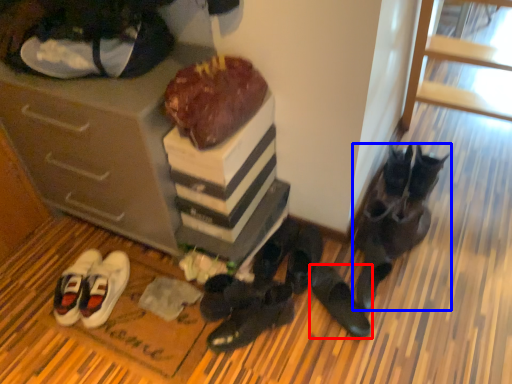
Question: Which of the following is the closest to the observer, footwear (highlighted by a red box) or footwear (highlighted by a blue box)?

Choices:
 (A) footwear
 (B) footwear

Answer: (A)